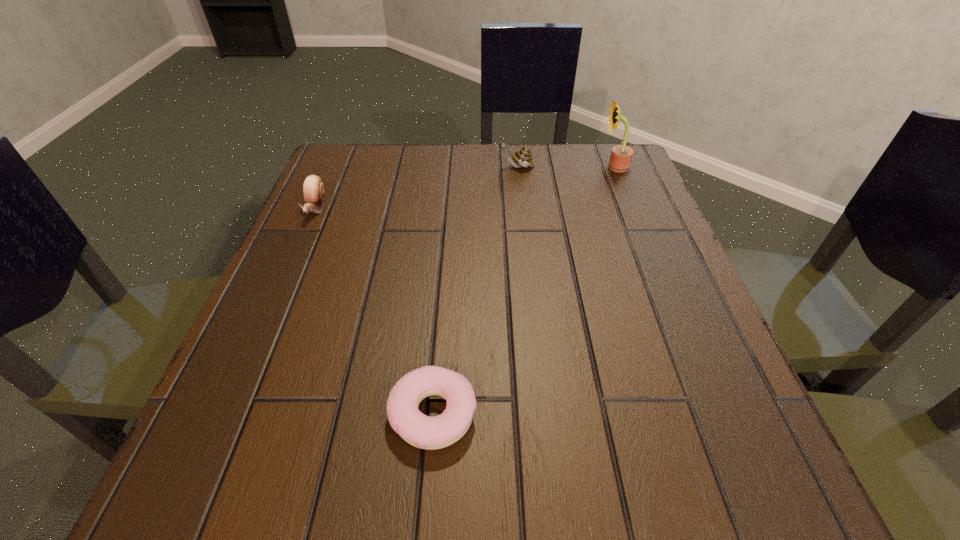
This screenshot has height=540, width=960. Identify the location of vacant area located 0.210m on the face of the sunflower. (511, 167).

Locate an element on the screen. The width and height of the screenshot is (960, 540). vacant area located 0.120m on the face of the farther escargot is located at coordinates (447, 167).

Identify the location of vacant space positioned on the face of the farther escargot. (379, 167).

Find the location of a particular element. The image size is (960, 540). vacant space situated 0.140m on the face of the farther escargot is located at coordinates (439, 167).

Where is `vacant space located 0.310m on the front-facing side of the leftmost object`? vacant space located 0.310m on the front-facing side of the leftmost object is located at coordinates (253, 349).

Where is `vacant space positioned on the right of the doughnut`? The image size is (960, 540). vacant space positioned on the right of the doughnut is located at coordinates (616, 414).

In order to click on sunflower at the far edge in this screenshot , I will do `click(621, 155)`.

I want to click on object that is at the near edge, so click(x=421, y=431).

In order to click on object that is at the left edge in this screenshot , I will do `click(313, 188)`.

The height and width of the screenshot is (540, 960). I want to click on object present at the right edge, so click(x=621, y=155).